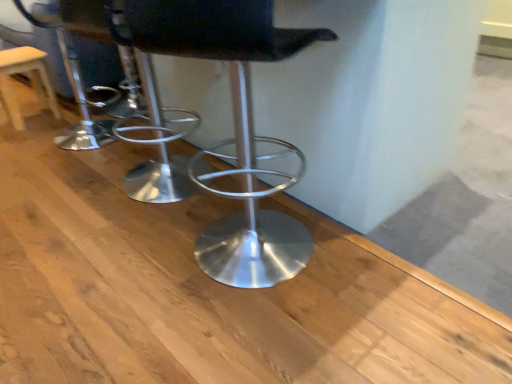
Locate an element on the screen. The height and width of the screenshot is (384, 512). wooden stool at left is located at coordinates (30, 80).

What do you see at coordinates (30, 80) in the screenshot?
I see `wooden stool at left` at bounding box center [30, 80].

This screenshot has width=512, height=384. Identify the location of metallic silver stool at center. (234, 125).

Measure the distance between point (258, 138) and camera.

5.33 feet.

The height and width of the screenshot is (384, 512). What do you see at coordinates (234, 125) in the screenshot?
I see `metallic silver stool at center` at bounding box center [234, 125].

You are a GUI agent. You are given a task and a screenshot of the screen. Output one action in this format:
    pyautogui.click(x=<x>, y=<y>)
    Task: Click on the wooden stool at left
    This screenshot has height=384, width=512.
    Given the screenshot: What is the action you would take?
    pyautogui.click(x=30, y=80)

Can you confirm if metallic silver stool at center is positioned to the left of wooden stool at left?

No, metallic silver stool at center is not to the left of wooden stool at left.

Is metallic silver stool at center positioned in front of wooden stool at left?

Yes.

Does point (251, 276) come behind point (2, 63)?

No, it is in front of (2, 63).

From the image's perspective, between metallic silver stool at center and wooden stool at left, who is located below?

metallic silver stool at center, from the image's perspective.

From a real-world perspective, relative to wooden stool at left, is metallic silver stool at center vertically above or below?

Clearly, from a real-world perspective, metallic silver stool at center is above wooden stool at left.

Does metallic silver stool at center have a lesser width compared to wooden stool at left?

Incorrect, the width of metallic silver stool at center is not less than that of wooden stool at left.

Can you confirm if metallic silver stool at center is taller than wooden stool at left?

Yes.

Can you confirm if metallic silver stool at center is smaller than wooden stool at left?

No, metallic silver stool at center is not smaller than wooden stool at left.

Is metallic silver stool at center inside or outside of wooden stool at left?

metallic silver stool at center is not enclosed by wooden stool at left.

Is metallic silver stool at center not near wooden stool at left?

Absolutely, metallic silver stool at center is distant from wooden stool at left.

Could you tell me if metallic silver stool at center is facing wooden stool at left?

No, metallic silver stool at center is not aimed at wooden stool at left.

Measure the distance from metallic silver stool at center to wooden stool at left.

They are 4.98 feet apart.

Identify the location of chair in front of the wooden stool at left. (234, 125).

Based on the photo, is wooden stool at left at the left side of metallic silver stool at center?

Yes, wooden stool at left is to the left of metallic silver stool at center.

Considering their positions, is wooden stool at left located in front of or behind metallic silver stool at center?

Clearly, wooden stool at left is behind metallic silver stool at center.

Considering the points (7, 105) and (255, 42), which point is in front, point (7, 105) or point (255, 42)?

The point (255, 42) is in front.

From the image's perspective, between wooden stool at left and metallic silver stool at center, which one is located above?

wooden stool at left.

From a real-world perspective, does wooden stool at left sit lower than metallic silver stool at center?

Yes, from a real-world perspective, wooden stool at left is below metallic silver stool at center.

Looking at their sizes, would you say wooden stool at left is wider or thinner than metallic silver stool at center?

Clearly, wooden stool at left has less width compared to metallic silver stool at center.

Does wooden stool at left have a lesser height compared to metallic silver stool at center?

Indeed, wooden stool at left has a lesser height compared to metallic silver stool at center.

Is wooden stool at left bigger or smaller than metallic silver stool at center?

wooden stool at left is smaller than metallic silver stool at center.

Is wooden stool at left not inside metallic silver stool at center?

Absolutely, wooden stool at left is external to metallic silver stool at center.

Is wooden stool at left in contact with metallic silver stool at center?

They are not placed beside each other.

Is wooden stool at left oriented towards metallic silver stool at center?

No, wooden stool at left is not facing towards metallic silver stool at center.

At what (x,y) coordinates should I click in order to perform the action: click on stool above the metallic silver stool at center (from the image's perspective). Please return your answer as a coordinate pair (x, y). The height and width of the screenshot is (384, 512). Looking at the image, I should click on (30, 80).

Identify the location of chair that appears on the right of wooden stool at left. The image size is (512, 384). (234, 125).

There is a wooden stool at left. Where is `chair above it (from a real-world perspective)`? The image size is (512, 384). chair above it (from a real-world perspective) is located at coordinates (234, 125).